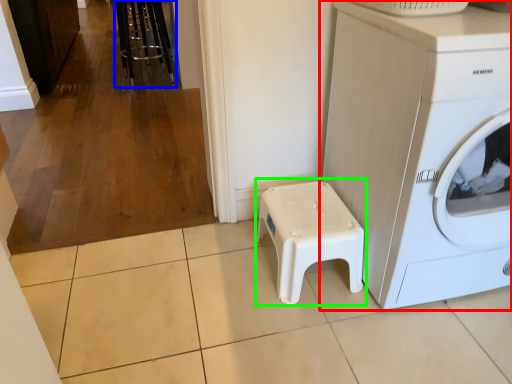
Question: Estimate the real-world distances between objects in this image. Which object is farther from washing machine (highlighted by a red box), bar stool (highlighted by a blue box) or music stool (highlighted by a green box)?

Choices:
 (A) bar stool
 (B) music stool

Answer: (A)